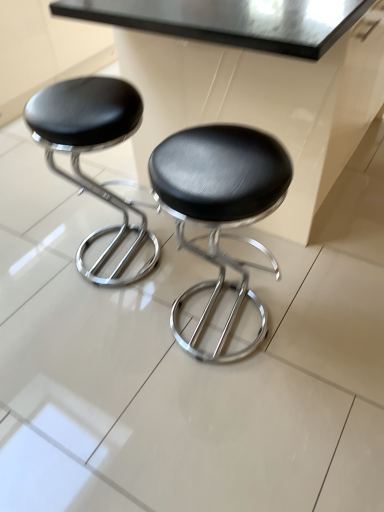
Question: From a real-world perspective, is black leather stool at center, arranged as the 1th stool when viewed from the right, above or below metallic black table at upper center?

Choices:
 (A) above
 (B) below

Answer: (B)

Question: Is point tap(211, 208) closer or farther from the camera than point tap(130, 20)?

Choices:
 (A) closer
 (B) farther

Answer: (A)

Question: Estimate the real-world distances between objects in this image. Which object is farther from the black leather stool at left, which appears as the second stool when viewed from the right?

Choices:
 (A) metallic black table at upper center
 (B) black leather stool at center, arranged as the 1th stool when viewed from the right

Answer: (B)

Question: Considering the real-world distances, which object is closest to the black leather stool at center, the second stool when ordered from left to right?

Choices:
 (A) black leather stool at left, marked as the first stool in a left-to-right arrangement
 (B) metallic black table at upper center

Answer: (B)